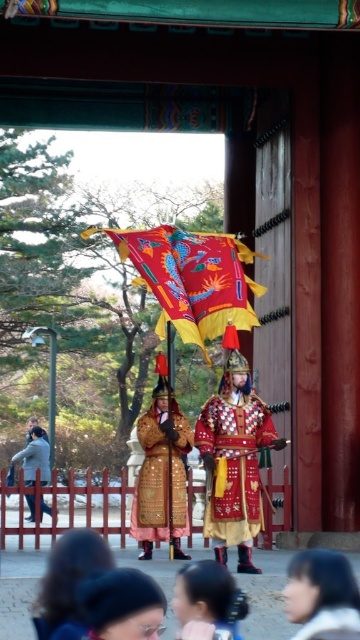
Question: Is embroidered silk robe at center to the right of smooth brown hair at lower left from the viewer's perspective?

Choices:
 (A) no
 (B) yes

Answer: (B)

Question: Among these objects, which one is nearest to the camera?

Choices:
 (A) smooth brown hair at lower left
 (B) gold textured robe at center
 (C) smooth beige hair at lower center
 (D) matte black hair at lower center

Answer: (D)

Question: Does gold textured robe at center appear on the left side of matte black hair at lower center?

Choices:
 (A) no
 (B) yes

Answer: (A)

Question: Among these points, which one is farthest from the camera?

Choices:
 (A) tap(194, 609)
 (B) tap(47, 512)
 (C) tap(225, 268)

Answer: (B)

Question: From the image, what is the correct spatial relationship of embroidered silk robe at center in relation to matte black hair at lower center?

Choices:
 (A) below
 (B) above

Answer: (B)

Question: Based on their relative distances, which object is farther from the smooth black hair at lower center?

Choices:
 (A) red velvet flag at center
 (B) gold metallic armor at lower left
 (C) embroidered silk robe at center
 (D) smooth beige hair at lower center

Answer: (B)